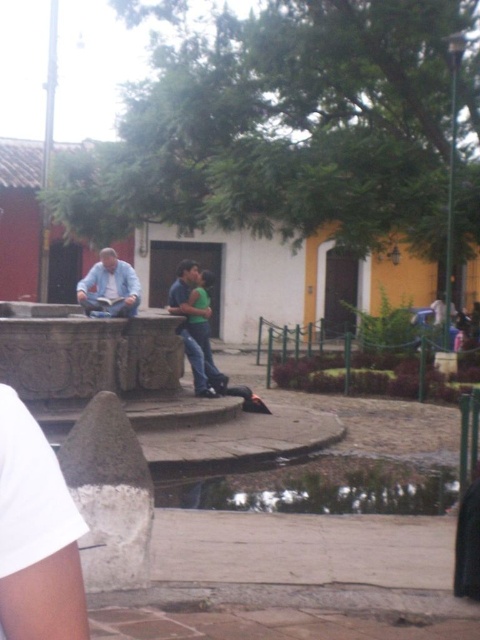
You are a fashion designer observing the scene. You need to create a coordinated outfit using the light blue denim shirt at center and the matte blue jeans at center. Given their current distance apart, can you easily access both items to design the outfit?

The light blue denim shirt at center and matte blue jeans at center are 3.67 feet apart from each other, so yes, the fashion designer can easily access both items to design the outfit since the distance is manageable.

You are standing in the plaza and want to take a photo of the clear water at lower center and the light blue denim shirt at center. Which object should you focus on first to ensure both are in the frame?

You should focus on the clear water at lower center first since it is closer to you than the light blue denim shirt at center, ensuring both remain in the frame.